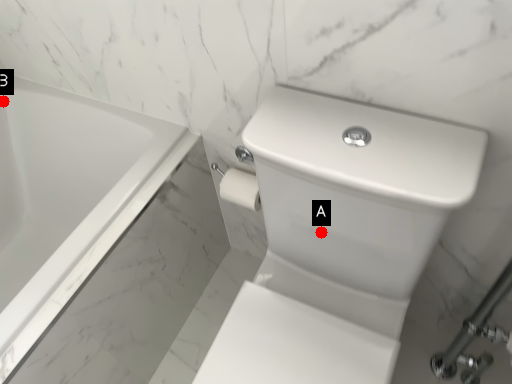
Question: Two points are circled on the image, labeled by A and B beside each circle. Which point is farther to the camera?

Choices:
 (A) A is further
 (B) B is further

Answer: (B)